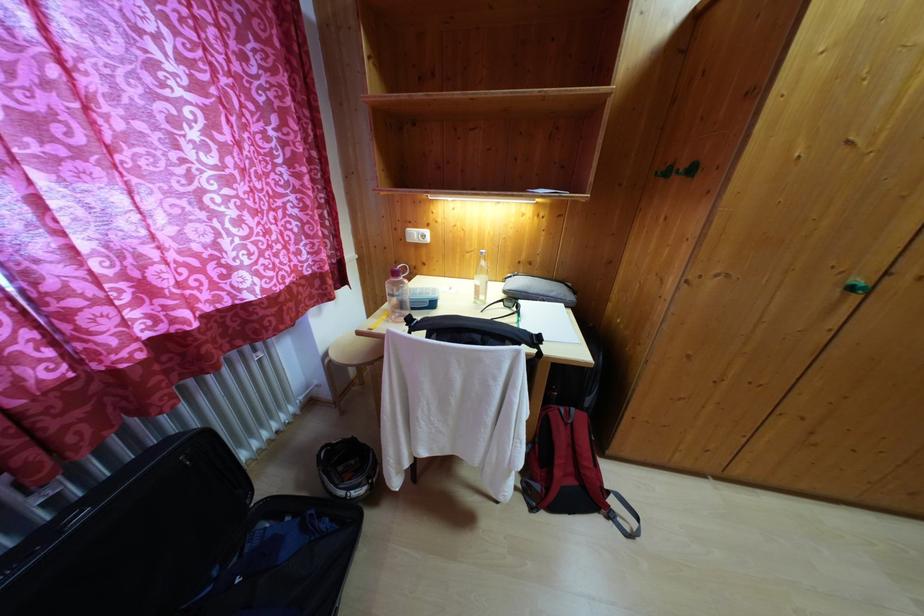
At what (x,y) coordinates should I click in order to perform the action: click on green cabinet knob. Please return your answer as a coordinate pair (x, y). The height and width of the screenshot is (616, 924). Looking at the image, I should click on (857, 286).